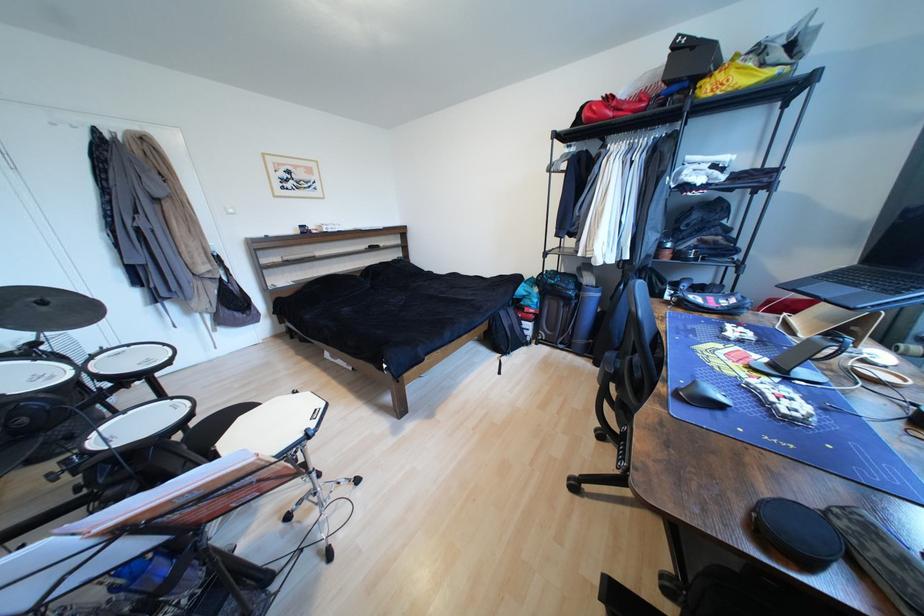
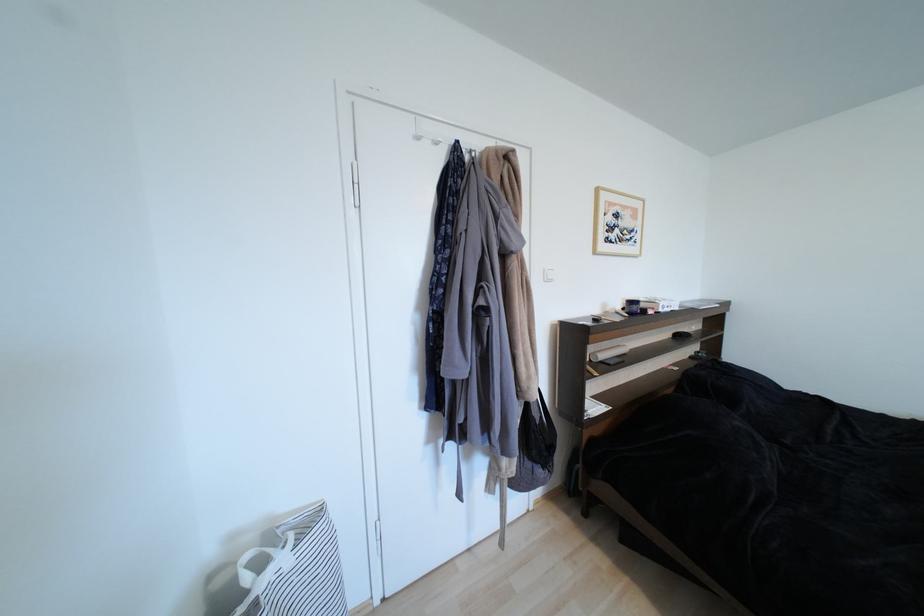
The point at (296, 174) is marked in the first image. Where is the corresponding point in the second image?

(623, 217)